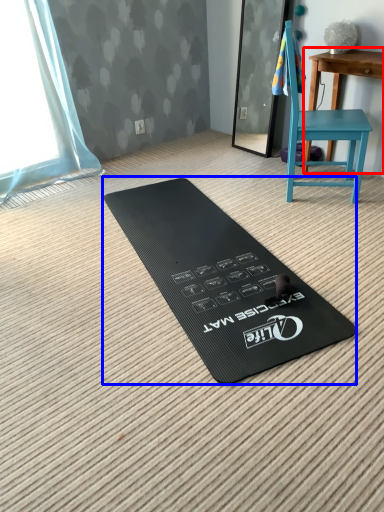
Question: Which point is further to the camera, table (highlighted by a red box) or yoga mat (highlighted by a blue box)?

Choices:
 (A) table
 (B) yoga mat

Answer: (A)